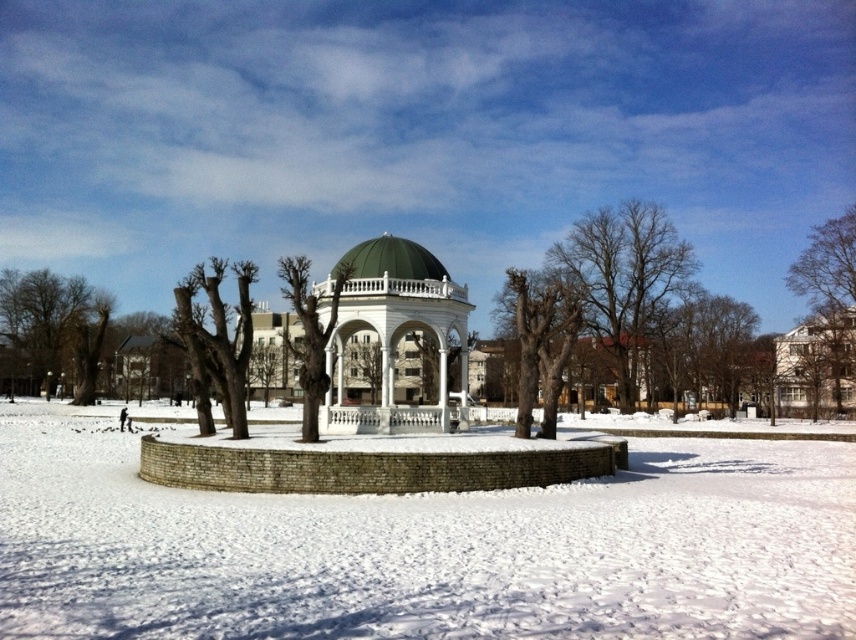
Which of these two, bare wood tree at left or bare wood trees at center, stands shorter?

Standing shorter between the two is bare wood trees at center.

Between bare wood tree at left and bare wood trees at center, which one appears on the left side from the viewer's perspective?

bare wood tree at left

This screenshot has height=640, width=856. I want to click on bare wood tree at left, so click(55, 324).

Does point (565, 356) come behind point (839, 307)?

That is False.

Between point (539, 369) and point (819, 257), which one is positioned in front?

Point (539, 369) is in front.

Who is more forward, (578, 292) or (841, 296)?

Positioned in front is point (578, 292).

Identify the location of bare wood trees at center. click(x=539, y=339).

Is bare branches at left to the right of green dome at center from the viewer's perspective?

No, bare branches at left is not to the right of green dome at center.

Does point (253, 268) come in front of point (352, 256)?

Yes.

Between point (188, 316) and point (432, 268), which one is positioned behind?

Positioned behind is point (432, 268).

Where is `bare branches at left`? Image resolution: width=856 pixels, height=640 pixels. bare branches at left is located at coordinates (218, 340).